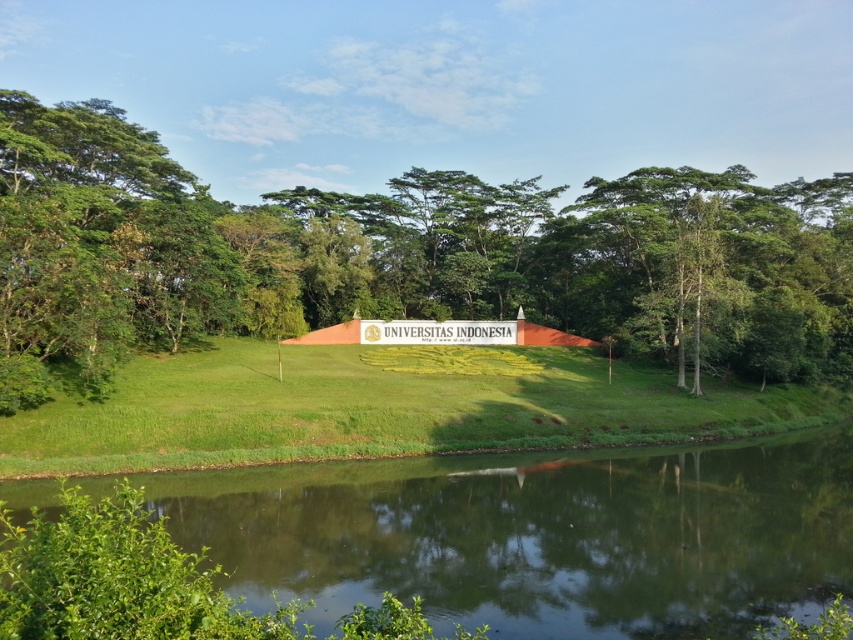
You are standing at the base of the hill in the scene and want to walk towards the two points marked in the image. Which point, point (636, 612) or point (585, 444), will you reach first?

You will reach point (636, 612) first because it is closer to you than point (585, 444).

You are a student at Universitas Indonesia who wants to take a photo of the sign and the green leafy tree at center. You are standing on the grassy area near the green smooth water at lower center. Which object should you point your camera towards first to capture both in the frame?

You should point your camera towards the green leafy tree at center first because it is taller than the green smooth water at lower center, so it will appear higher in the frame, allowing both to be captured together.

You are standing on the path leading to the Universitas Indonesia sign. You see the green leafy tree at center and the green grassy hill at center. Which object is closer to you?

The green leafy tree at center is closer to you than the green grassy hill at center because it is positioned further to the viewer.